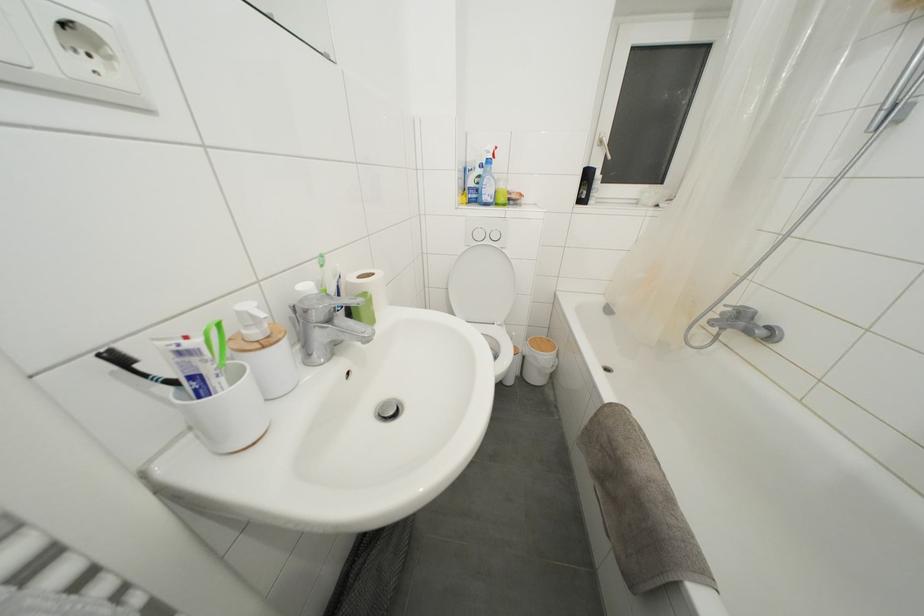
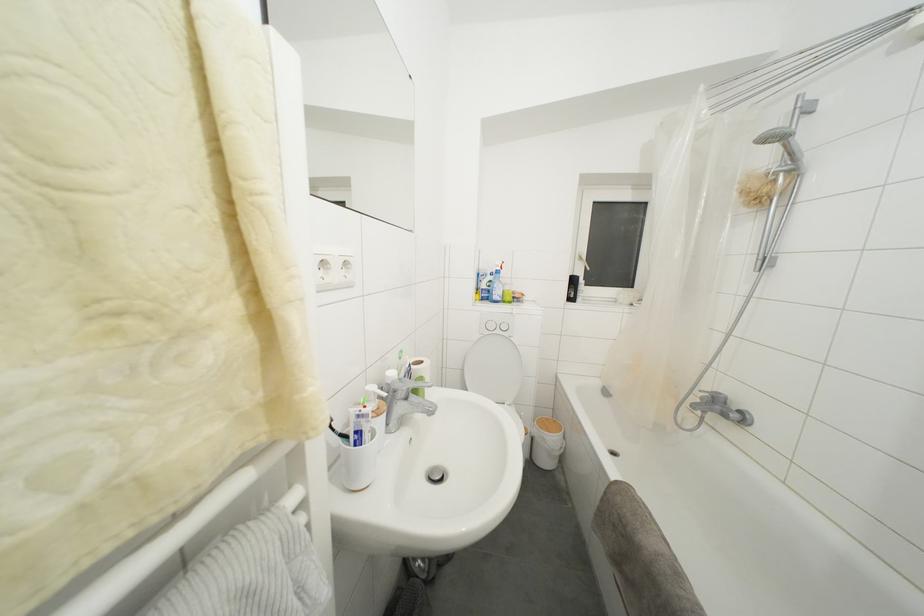
Locate, in the second image, the point that corresponds to the point at 185,358 in the first image.

(362, 421)